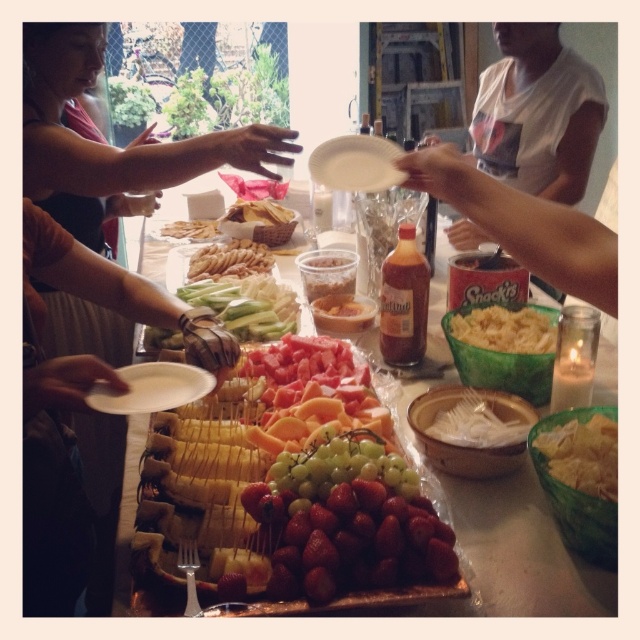
Question: Is matte black shirt at upper left closer to the viewer compared to smooth plastic snack pak at center?

Choices:
 (A) no
 (B) yes

Answer: (A)

Question: Estimate the real-world distances between objects in this image. Which object is farther from the white paper plate at lower left?

Choices:
 (A) matte green bowl at lower right
 (B) golden crispy crackers at center
 (C) smooth plastic snack pak at center

Answer: (B)

Question: Estimate the real-world distances between objects in this image. Which object is closer to the green matte bowl of pasta at center?

Choices:
 (A) matte brown crackers at center
 (B) matte black shirt at upper left

Answer: (B)

Question: Observing the image, what is the correct spatial positioning of shiny plastic tray at center in reference to matte brown crackers at center?

Choices:
 (A) above
 (B) below

Answer: (B)

Question: Estimate the real-world distances between objects in this image. Which object is farther from the golden crispy crackers at center?

Choices:
 (A) white paper plate at lower left
 (B) smooth plastic snack pak at center
 (C) matte black shirt at upper left
 (D) white cracker at center

Answer: (B)

Question: Does matte black shirt at upper left appear under shiny plastic tray at center?

Choices:
 (A) yes
 (B) no

Answer: (B)